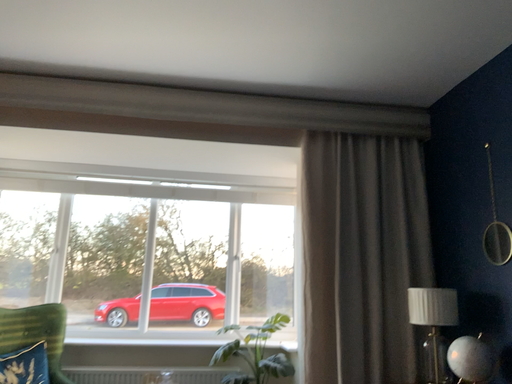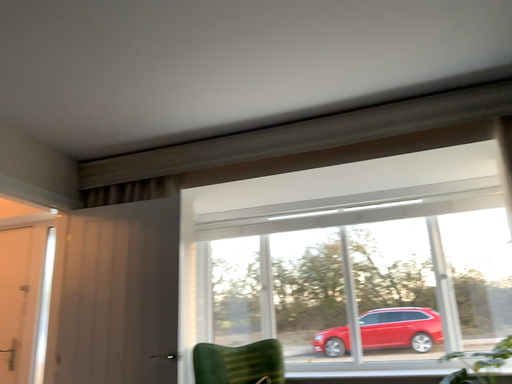
Question: How did the camera likely rotate when shooting the video?

Choices:
 (A) rotated right
 (B) rotated left

Answer: (B)